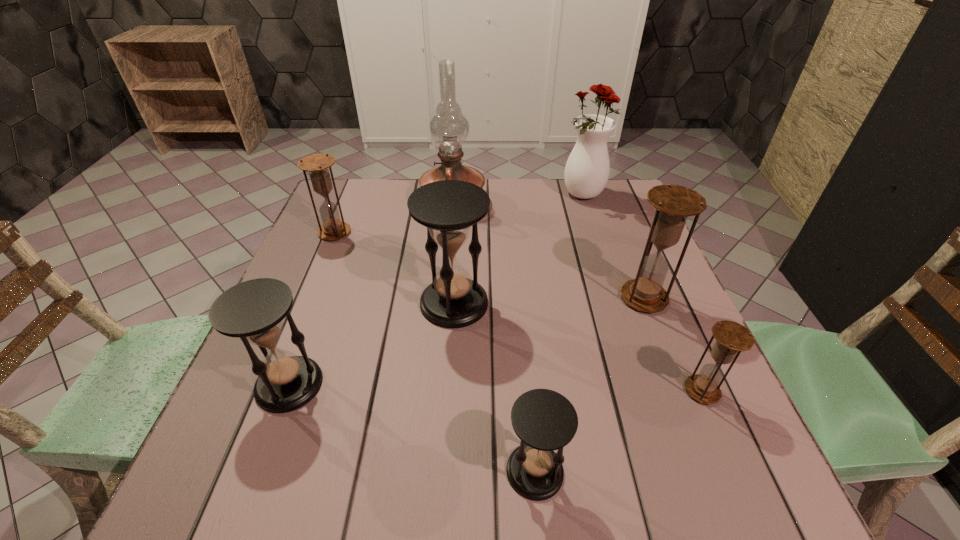
Where is `the nearest brown hourglass`? the nearest brown hourglass is located at coordinates (732, 337).

You are a GUI agent. You are given a task and a screenshot of the screen. Output one action in this format:
    pyautogui.click(x=<x>, y=<y>)
    Task: Click on the nearest hourglass
    
    Given the screenshot: What is the action you would take?
    pyautogui.click(x=544, y=420)

Find the location of a particular element. This screenshot has width=960, height=540. the nearest black hourglass is located at coordinates (544, 420).

Find the location of a particular element. The height and width of the screenshot is (540, 960). blank space located 0.310m on the right of the oil lamp is located at coordinates (589, 202).

This screenshot has height=540, width=960. I want to click on vacant point located on the left of the red vase, so click(475, 195).

Locate an element on the screen. This screenshot has height=540, width=960. vacant space situated on the back of the third hourglass from left to right is located at coordinates (459, 222).

Identify the location of vacant space located on the front of the biggest brown hourglass. (683, 398).

What are the coordinates of `vacant space situated 0.060m on the back of the second smallest black hourglass` in the screenshot? It's located at (308, 335).

The image size is (960, 540). What are the coordinates of `vacant space positioned 0.230m on the front of the second biggest brown hourglass` in the screenshot? It's located at (305, 305).

You are a GUI agent. You are given a task and a screenshot of the screen. Output one action in this format:
    pyautogui.click(x=<x>, y=<y>)
    Task: Click on the vacant space located on the left of the smallest brown hourglass
    
    Given the screenshot: What is the action you would take?
    pyautogui.click(x=573, y=390)